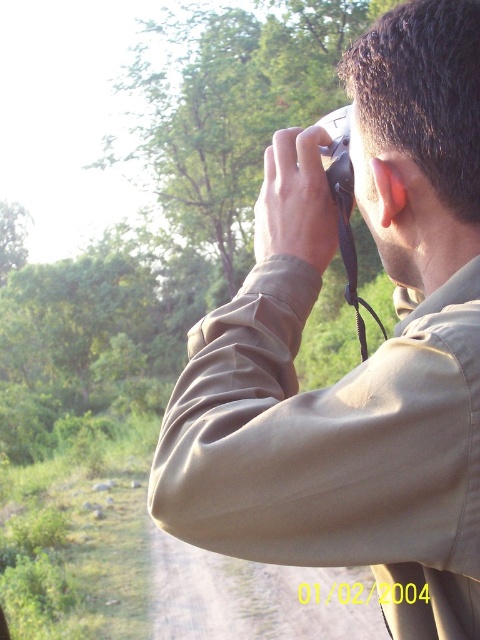
Question: Is matte khaki shirt at center bigger than black plastic camera at upper center?

Choices:
 (A) no
 (B) yes

Answer: (B)

Question: Is matte khaki shirt at center wider than black plastic camera at upper center?

Choices:
 (A) yes
 (B) no

Answer: (A)

Question: From the image, what is the correct spatial relationship of matte khaki shirt at center in relation to black plastic camera at upper center?

Choices:
 (A) left
 (B) right

Answer: (B)